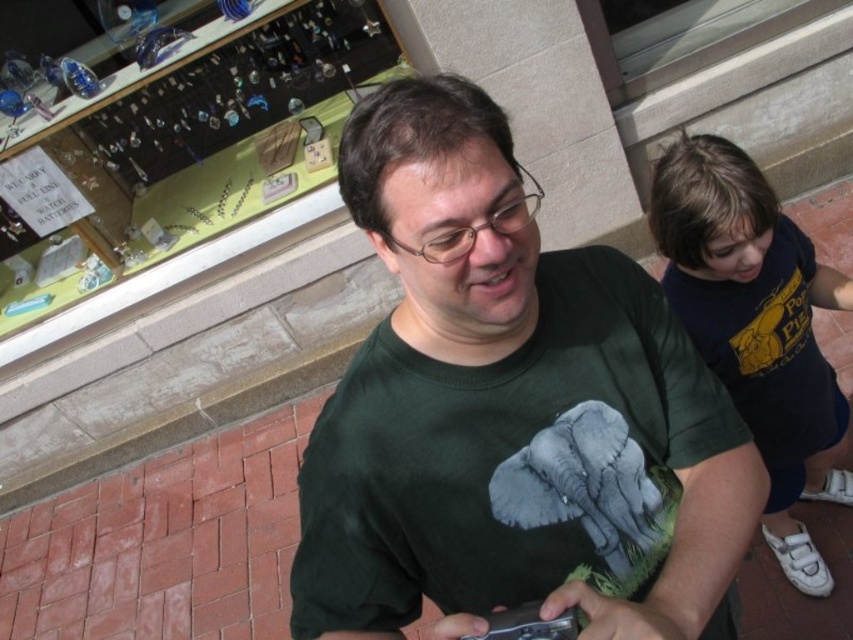
Question: Which of the following is the farthest from the observer?

Choices:
 (A) (693, 216)
 (B) (405, 179)

Answer: (A)

Question: Which object appears closest to the camera in this image?

Choices:
 (A) dark blue t-shirt at upper right
 (B) green matte t-shirt at center

Answer: (B)

Question: Observing the image, what is the correct spatial positioning of green matte t-shirt at center in reference to dark blue t-shirt at upper right?

Choices:
 (A) above
 (B) below

Answer: (B)

Question: Is green matte t-shirt at center thinner than dark blue t-shirt at upper right?

Choices:
 (A) no
 (B) yes

Answer: (B)

Question: Does green matte t-shirt at center appear on the right side of dark blue t-shirt at upper right?

Choices:
 (A) no
 (B) yes

Answer: (A)

Question: Which of the following is the closest to the observer?

Choices:
 (A) dark blue t-shirt at upper right
 (B) green matte t-shirt at center

Answer: (B)